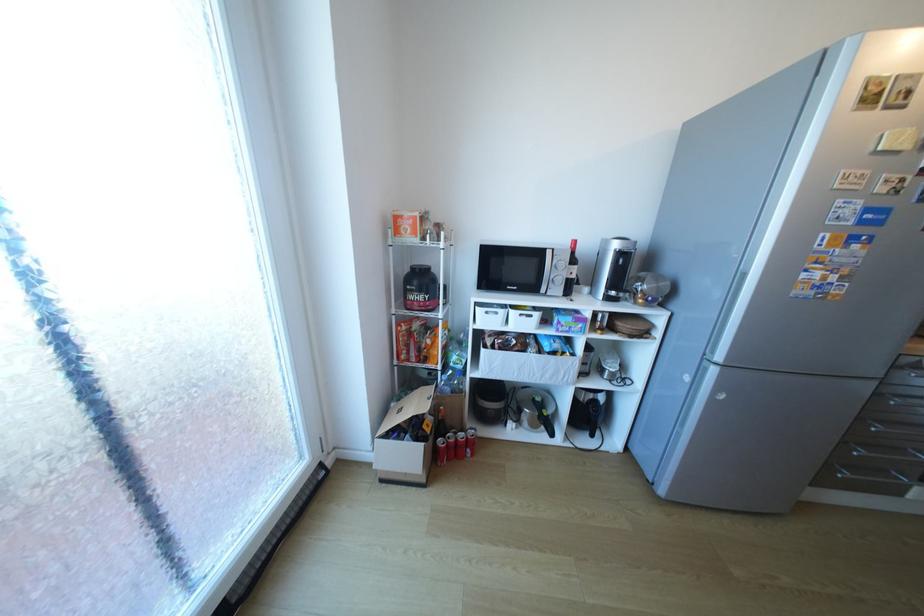
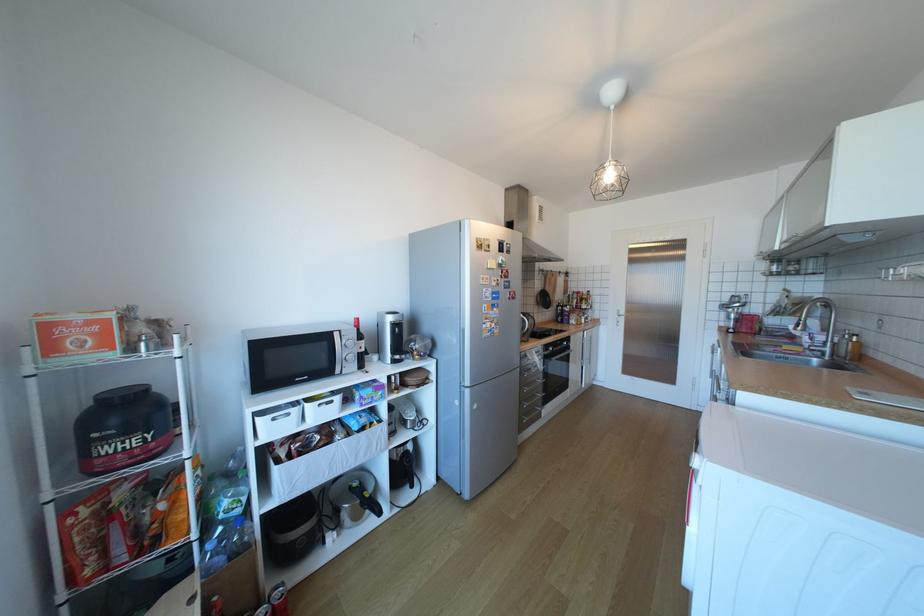
Find the pixel in the second image that matches point (548, 254) in the first image.

(334, 338)